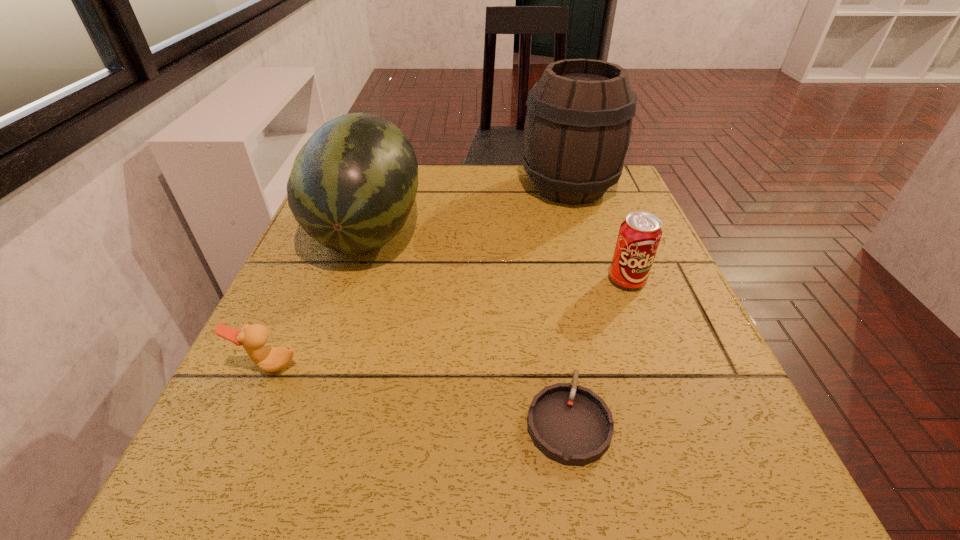
Identify the location of blank space located 0.050m on the beak of the duck. The height and width of the screenshot is (540, 960). (251, 405).

Locate an element on the screen. free region located on the left of the shortest object is located at coordinates (416, 420).

Locate an element on the screen. The image size is (960, 540). wine bucket that is at the far edge is located at coordinates (578, 124).

This screenshot has height=540, width=960. I want to click on watermelon at the far edge, so click(x=352, y=186).

Locate an element on the screen. object located in the near edge section of the desktop is located at coordinates (571, 425).

I want to click on watermelon situated at the left edge, so click(x=352, y=186).

Identify the location of duck that is at the left edge. (253, 337).

In order to click on wine bucket at the right edge in this screenshot , I will do `click(578, 124)`.

I want to click on soda situated at the right edge, so click(x=639, y=236).

Where is `object that is at the far left corner`? object that is at the far left corner is located at coordinates (352, 186).